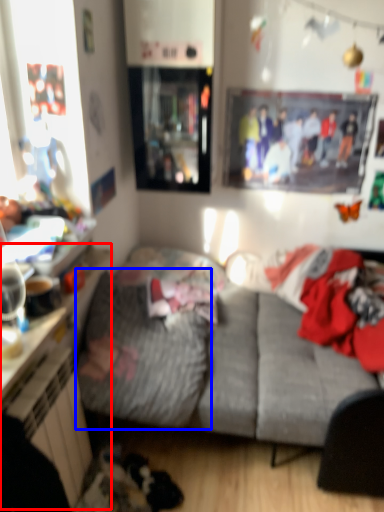
Question: Which point is further to the camera, dresser (highlighted by a red box) or blanket (highlighted by a blue box)?

Choices:
 (A) dresser
 (B) blanket

Answer: (B)